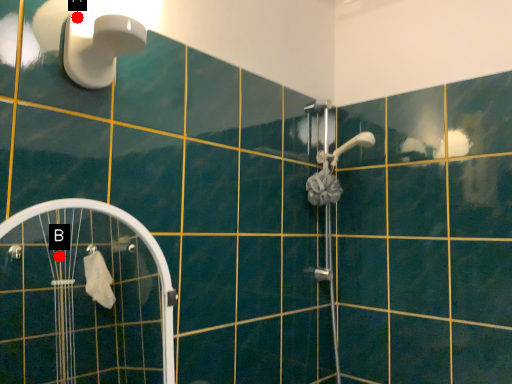
Question: Two points are circled on the image, labeled by A and B beside each circle. Which point appears closest to the camera in this image?

Choices:
 (A) A is closer
 (B) B is closer

Answer: (A)